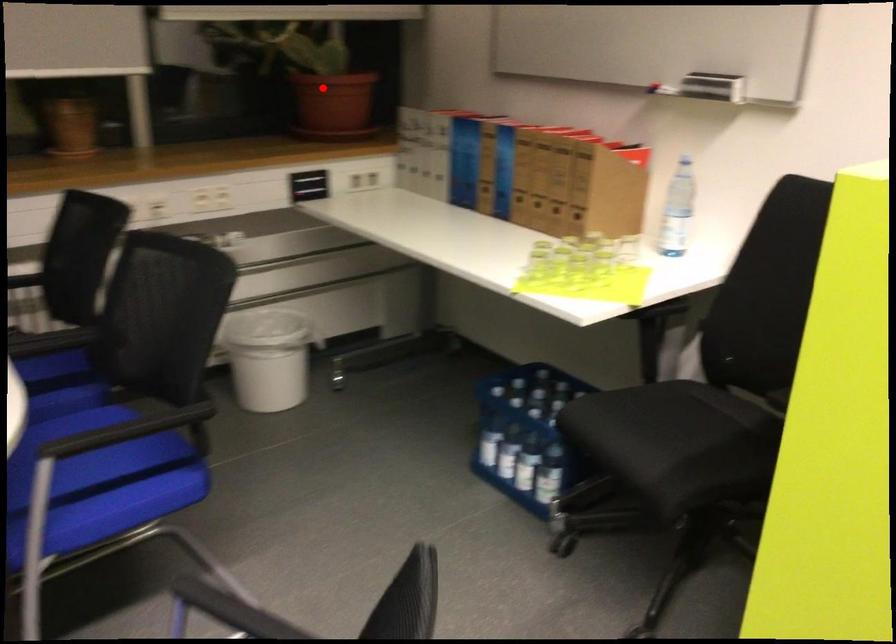
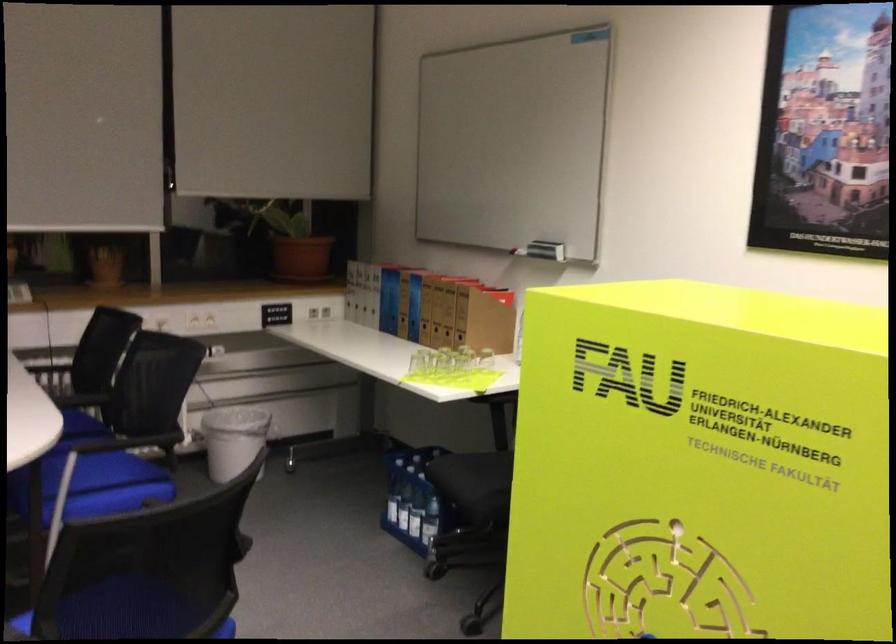
Question: I am providing you with two images of the same scene from different viewpoints. A red point is shown in image1. For the corresponding object point in image2, is it positioned nearer or farther from the camera?

Choices:
 (A) Nearer
 (B) Farther

Answer: (B)